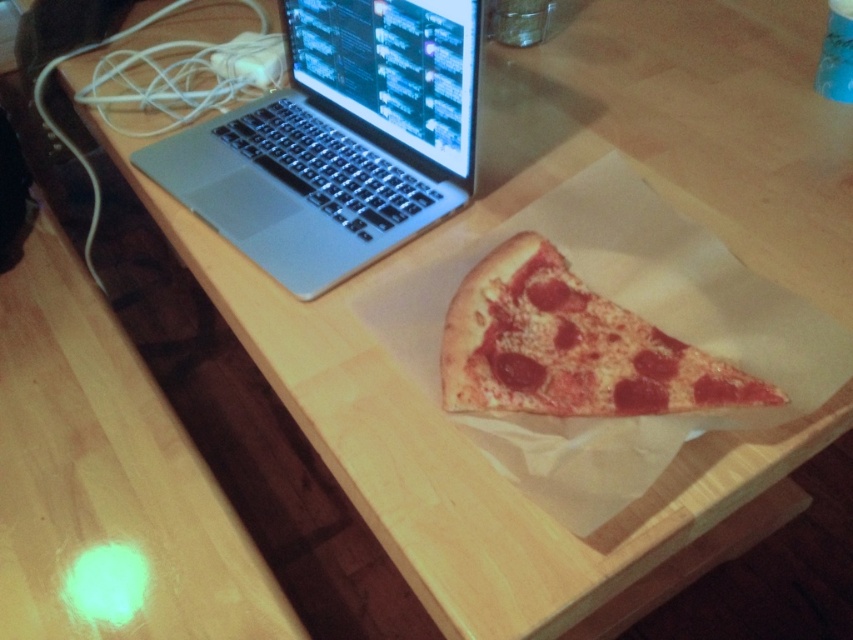
How far apart are silver metallic laptop at upper left and cheesy pepperoni pizza at center?

They are 9.65 inches apart.

Between silver metallic laptop at upper left and cheesy pepperoni pizza at center, which one has more height?

Standing taller between the two is silver metallic laptop at upper left.

Who is more distant from viewer, (439, 48) or (451, 330)?

Point (439, 48)

Find the location of a particular element. The height and width of the screenshot is (640, 853). silver metallic laptop at upper left is located at coordinates (338, 140).